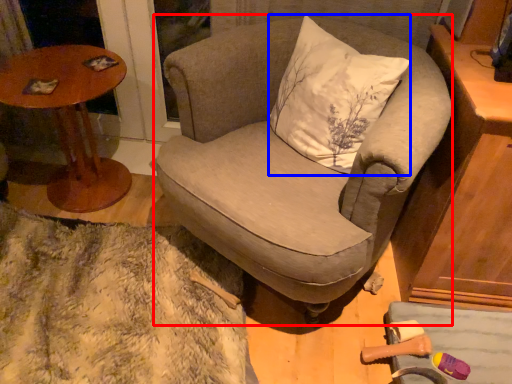
Question: Which point is closer to the camera, chair (highlighted by a red box) or pillow (highlighted by a blue box)?

Choices:
 (A) chair
 (B) pillow

Answer: (A)